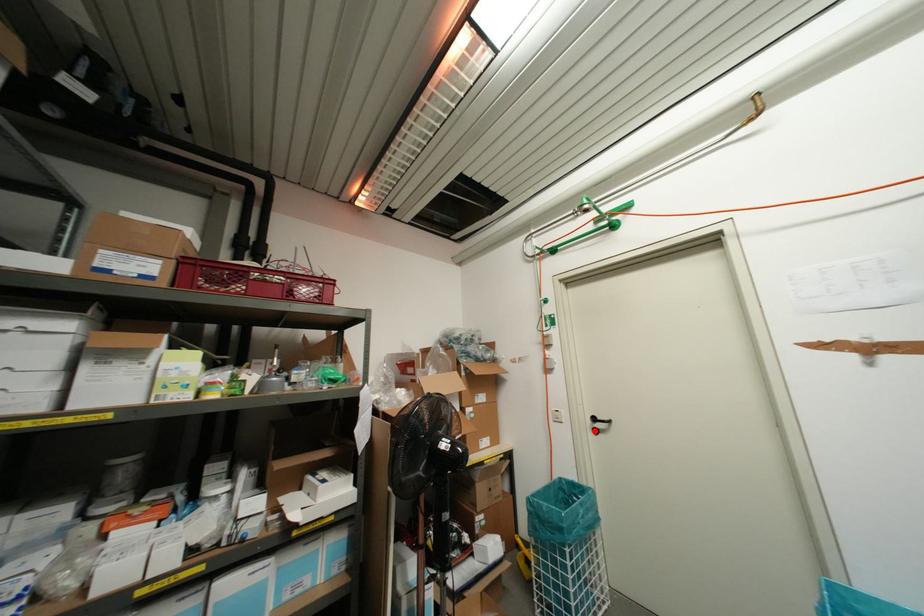
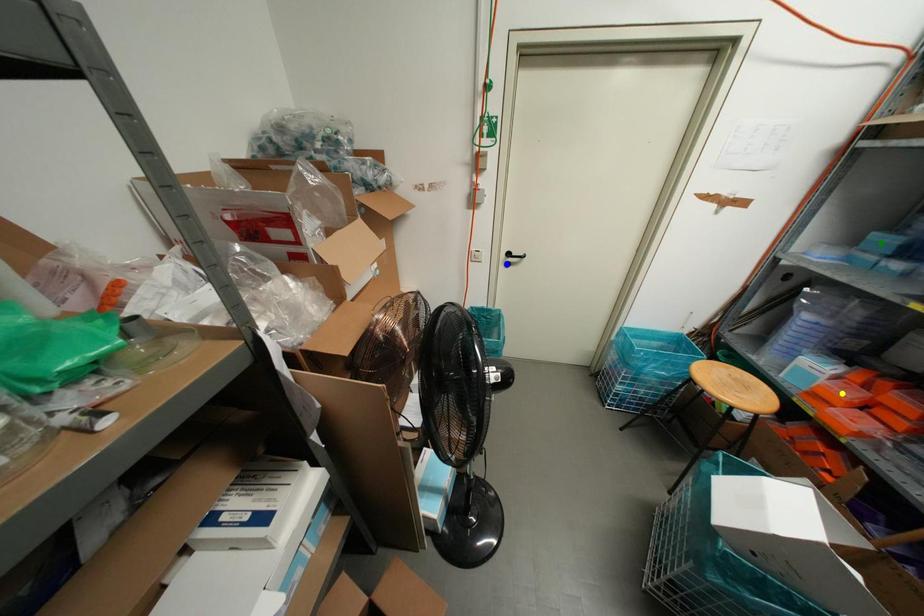
Question: I am providing you with two images of the same scene from different viewpoints. A red point is marked on the first image. You are given multiple points on the second image. Which spot in image 2 lines up with the point in image 1?

Choices:
 (A) green point
 (B) blue point
 (C) yellow point

Answer: (B)